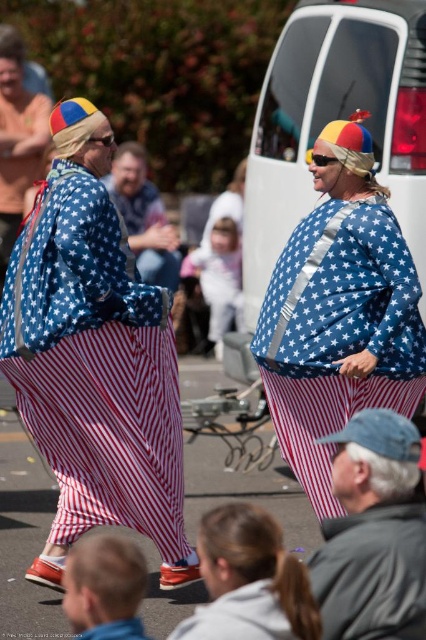
Is red-white-striped pants at lower center shorter than blue denim jeans at center?

Indeed, red-white-striped pants at lower center has a lesser height compared to blue denim jeans at center.

Looking at this image, can you confirm if red-white-striped pants at lower center is smaller than blue denim jeans at center?

Correct, red-white-striped pants at lower center occupies less space than blue denim jeans at center.

This screenshot has width=426, height=640. What are the coordinates of `red-white-striped pants at lower center` in the screenshot? It's located at (249, 580).

The height and width of the screenshot is (640, 426). I want to click on red-white-striped pants at lower center, so click(249, 580).

Between point (348, 522) and point (92, 541), which one is positioned behind?

Point (348, 522)

Can you confirm if gray fabric jacket at lower right is bigger than blonde hair at lower left?

Yes, gray fabric jacket at lower right is bigger than blonde hair at lower left.

Between point (328, 620) and point (132, 560), which one is positioned in front?

Point (132, 560)

Locate an element on the screen. gray fabric jacket at lower right is located at coordinates (373, 534).

Is point (414, 481) closer to viewer compared to point (143, 176)?

Yes, it is.

Between point (405, 630) and point (123, 220), which one is positioned behind?

The point (123, 220) is more distant.

Locate an element on the screen. The width and height of the screenshot is (426, 640). gray fabric jacket at lower right is located at coordinates (373, 534).